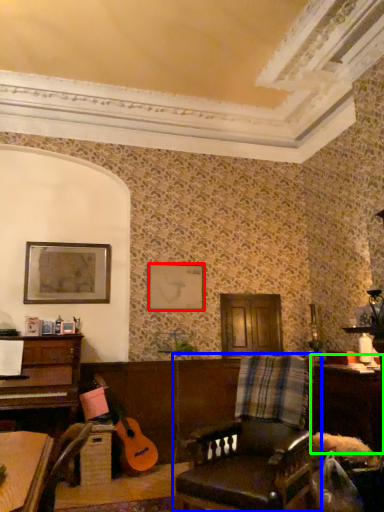
Question: Based on their relative distances, which object is farther from picture frame (highlighted by a red box)? Choose from chair (highlighted by a blue box) and table (highlighted by a green box).

Choices:
 (A) chair
 (B) table

Answer: (A)